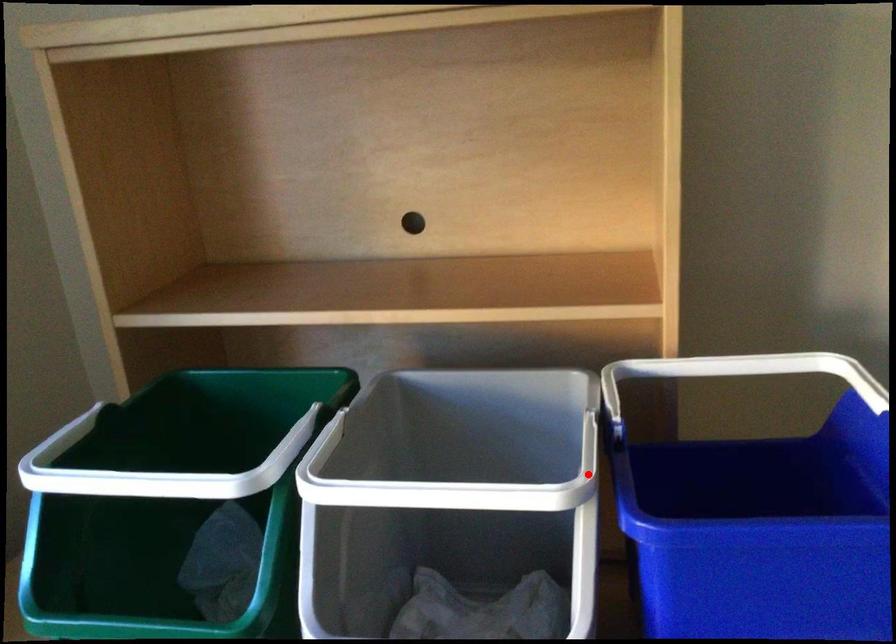
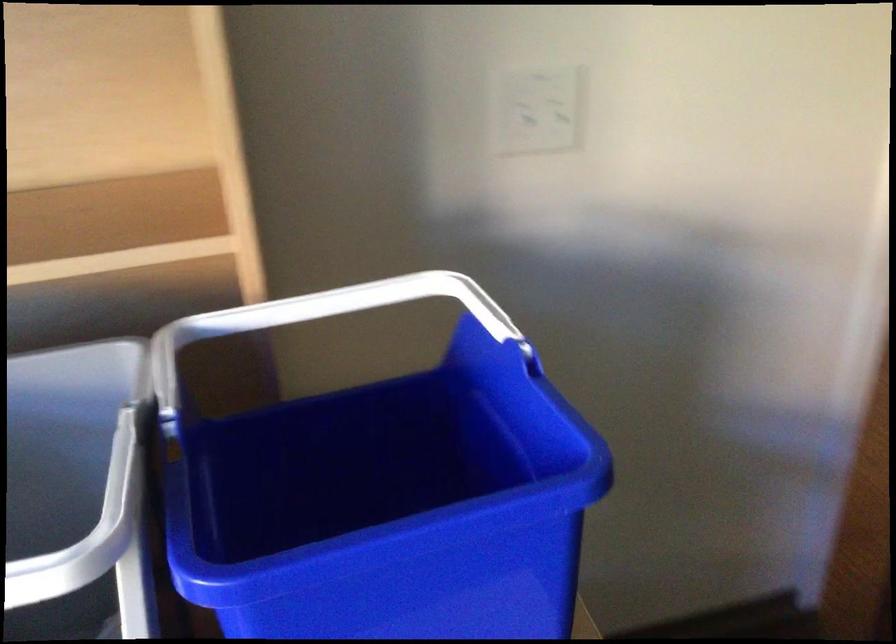
Question: I am providing you with two images of the same scene from different viewpoints. In image1, a red point is highlighted. Considering the same 3D point in image2, which of the following is correct?

Choices:
 (A) It is closer
 (B) It is farther

Answer: (A)